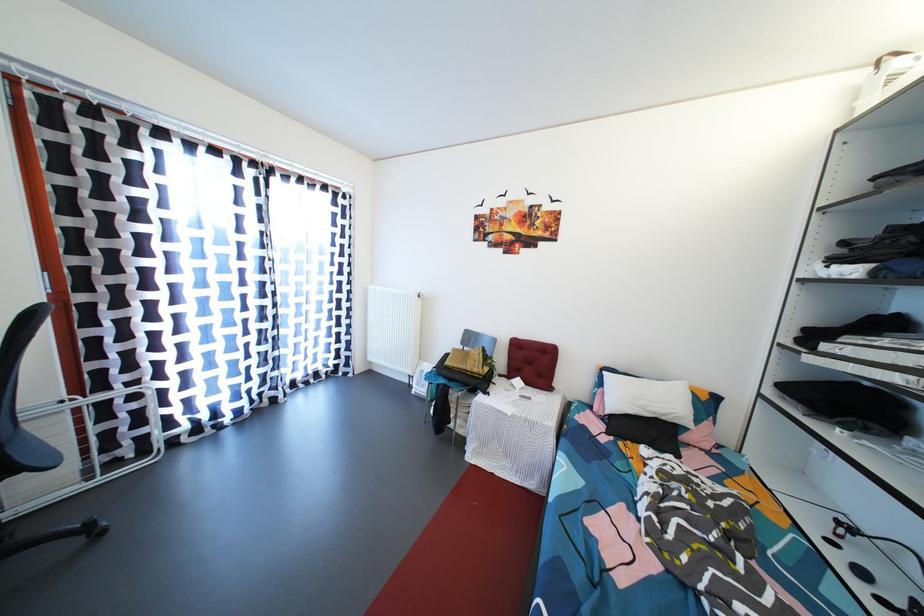
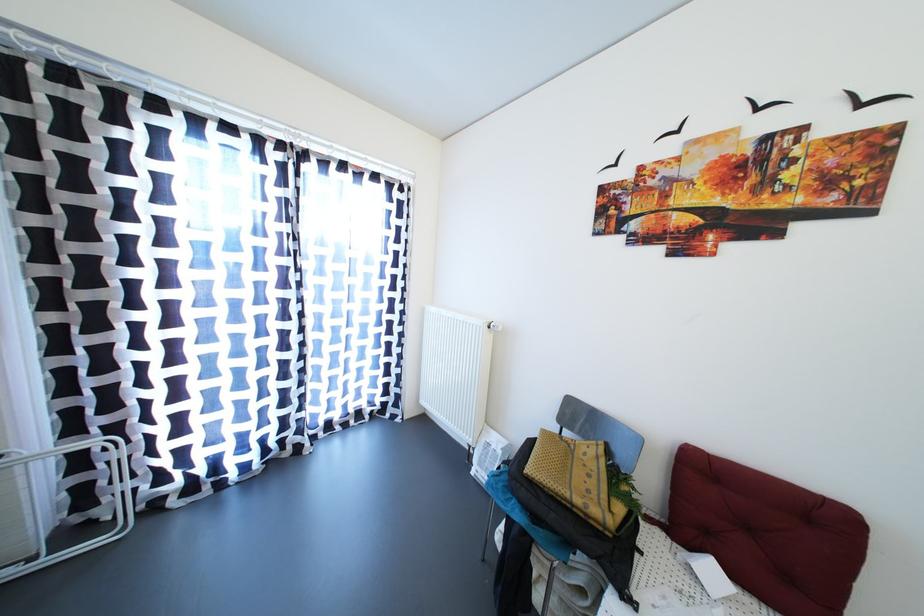
Where in the second image is the point corresponding to point 98,484 from the first image?

(39, 564)